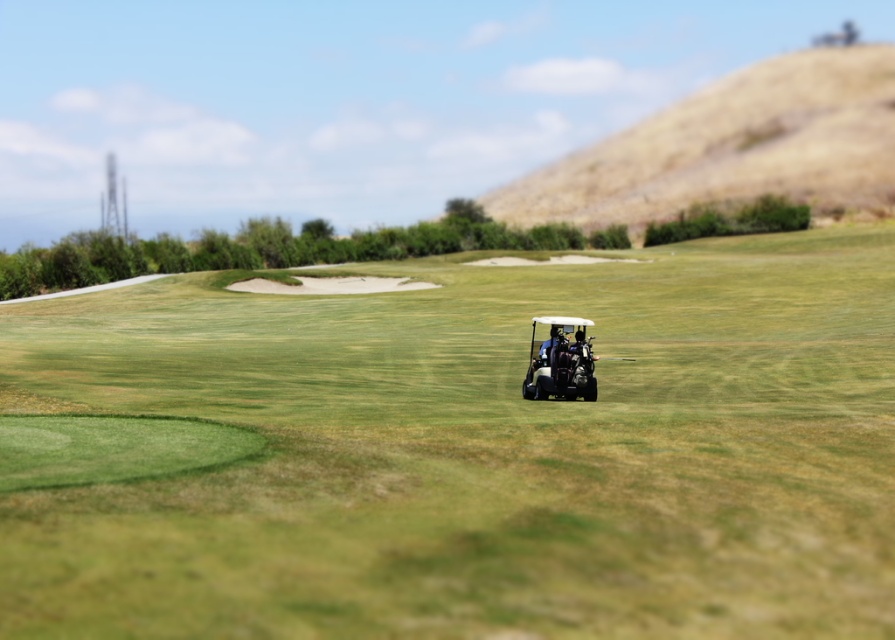
Question: Can you confirm if dried grass hill at upper right is wider than matte black golf cart at center?

Choices:
 (A) yes
 (B) no

Answer: (A)

Question: Which object appears closest to the camera in this image?

Choices:
 (A) matte black golf cart at center
 (B) dried grass hill at upper right

Answer: (A)

Question: Can you confirm if dried grass hill at upper right is smaller than matte black golf cart at center?

Choices:
 (A) no
 (B) yes

Answer: (A)

Question: Which of the following is the closest to the observer?

Choices:
 (A) (388, 596)
 (B) (740, 177)
 (C) (567, 332)

Answer: (A)

Question: Does white plastic golf cart at center appear under dried grass hill at upper right?

Choices:
 (A) no
 (B) yes

Answer: (B)

Question: Which point is closer to the camera?

Choices:
 (A) (563, 346)
 (B) (597, 214)

Answer: (A)